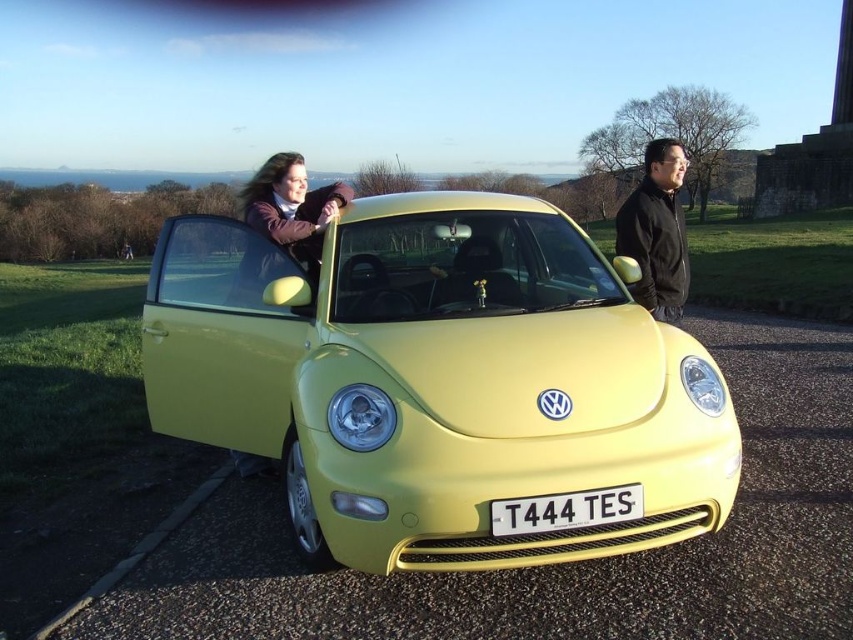
Question: Which point is farther to the camera?

Choices:
 (A) matte purple jacket at upper left
 (B) black matte jacket at right

Answer: (B)

Question: Does black matte jacket at right have a larger size compared to white plastic license plate at center?

Choices:
 (A) no
 (B) yes

Answer: (B)

Question: Does lime matte car at center have a greater width compared to white plastic license plate at center?

Choices:
 (A) yes
 (B) no

Answer: (A)

Question: Among these points, which one is nearest to the camera?

Choices:
 (A) pos(618,218)
 (B) pos(454,403)

Answer: (B)

Question: Does matte purple jacket at upper left come in front of white plastic license plate at center?

Choices:
 (A) no
 (B) yes

Answer: (A)

Question: Which object appears farthest from the camera in this image?

Choices:
 (A) black matte jacket at right
 (B) matte purple jacket at upper left
 (C) white plastic license plate at center

Answer: (A)